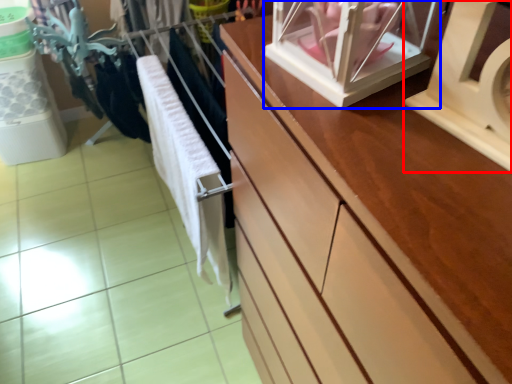
Question: Which object appears closest to the camera in this image, wide (highlighted by a red box) or glass box (highlighted by a blue box)?

Choices:
 (A) wide
 (B) glass box

Answer: (A)